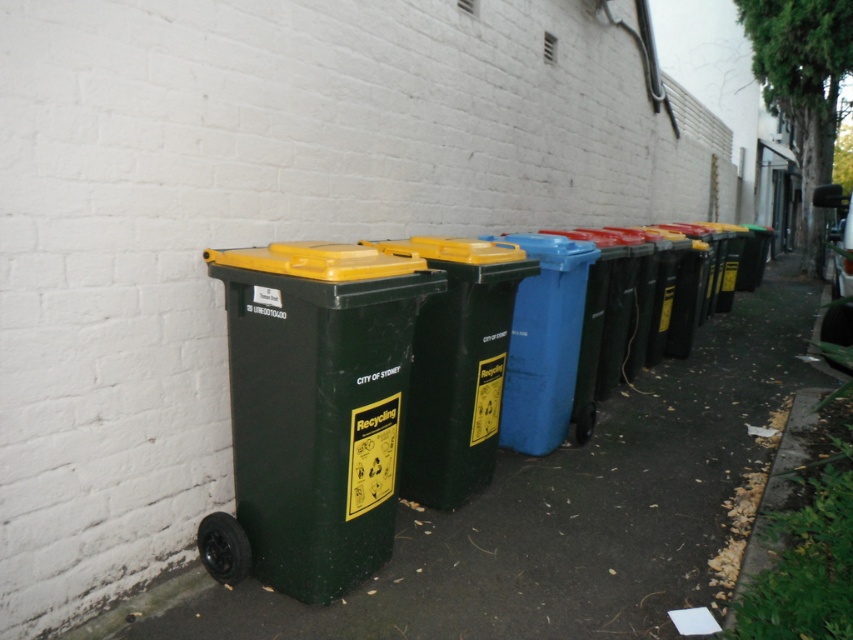
Question: Which point appears farthest from the camera in this image?

Choices:
 (A) (689, 532)
 (B) (526, 433)
 (C) (442, 448)

Answer: (B)

Question: Which point is farther from the camera taking this photo?

Choices:
 (A) (236, 540)
 (B) (485, 428)

Answer: (B)

Question: Can you confirm if green plastic bin at left is thinner than blue plastic bin at center?

Choices:
 (A) no
 (B) yes

Answer: (B)

Question: Does matte green recycling bin at left have a lesser width compared to blue plastic bin at center?

Choices:
 (A) no
 (B) yes

Answer: (A)

Question: Does green plastic recycling bin at center appear on the left side of blue plastic bin at center?

Choices:
 (A) no
 (B) yes

Answer: (B)

Question: Which point is farther to the camera?

Choices:
 (A) (527, 289)
 (B) (490, 394)
 (C) (314, 248)
 (D) (685, 586)

Answer: (A)